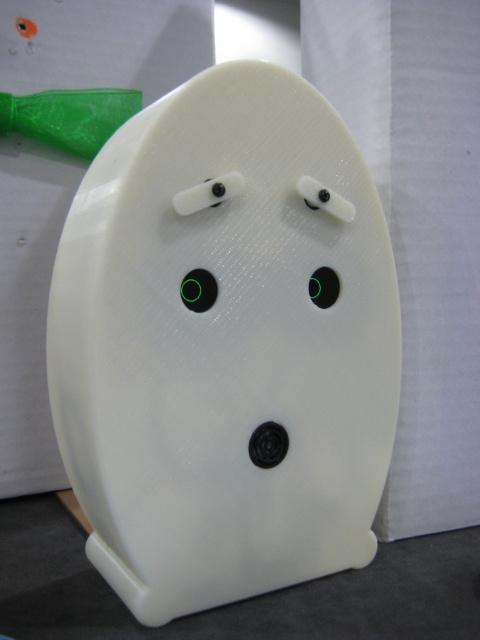
You are designing a puzzle game where players must identify matching objects based on their descriptions. In the image provided, there are two objects labeled as matte black circle at center and black matte circle at center. According to the scene description, which of these two objects is taller?

The matte black circle at center is taller than the black matte circle at center.

You are a plumber inspecting a bathroom fixture. You see the white matte urinal at center and the matte black circle at center. Which object is taller?

The white matte urinal at center is much taller than the matte black circle at center.